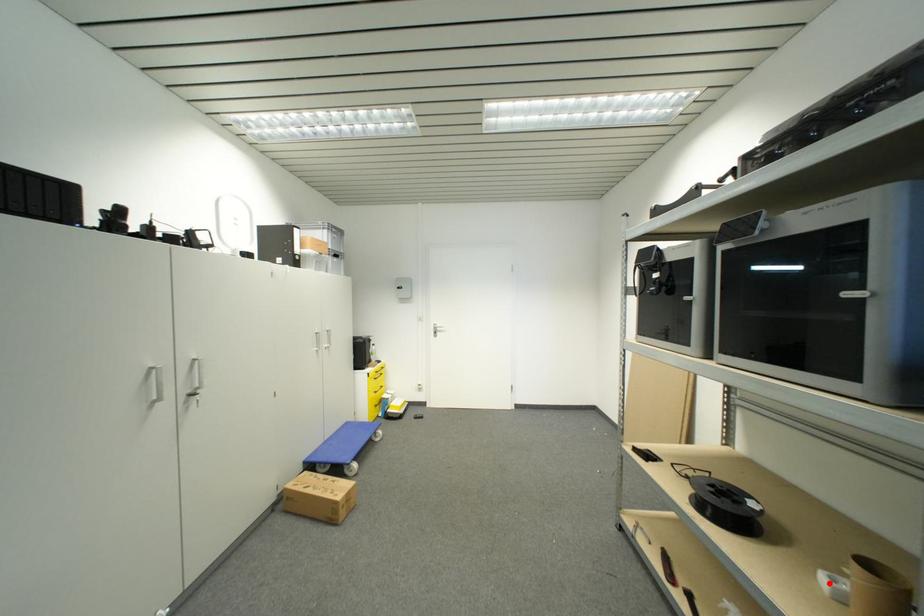
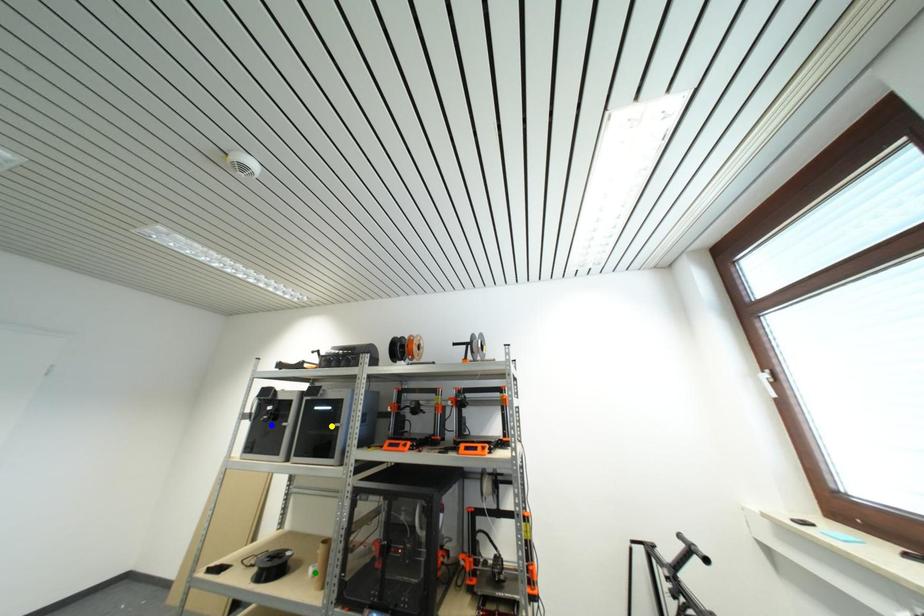
Question: I am providing you with two images of the same scene from different viewpoints. A red point is marked on the first image. You are given multiple points on the second image. Which point in image 2 represents the same 3d spot as the red point in image 1?

Choices:
 (A) yellow point
 (B) green point
 (C) blue point

Answer: (B)